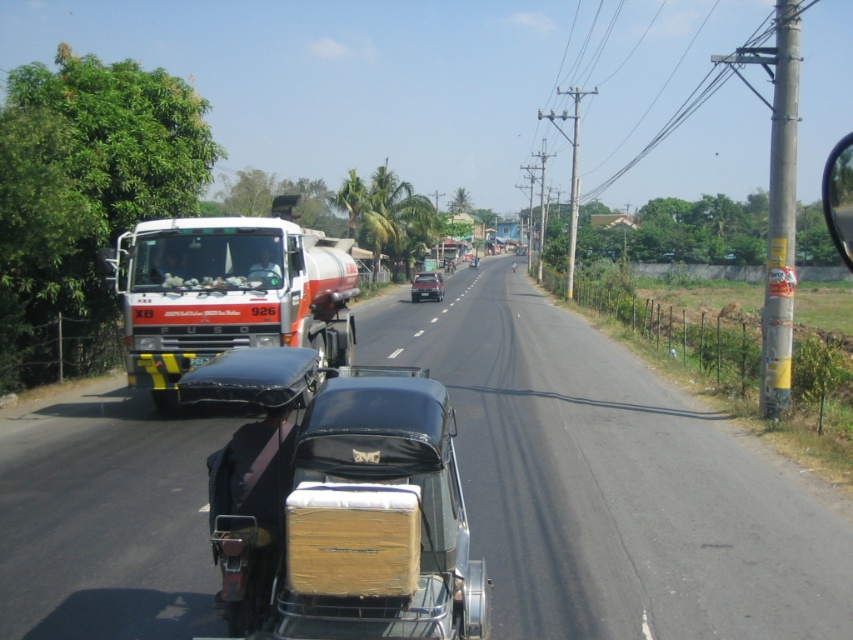
Does point (310, 556) come behind point (421, 291)?

No.

Who is shorter, matte black car at center or shiny silver sedan at center?

Standing shorter between the two is matte black car at center.

Is point (465, 540) in front of point (431, 280)?

Yes, point (465, 540) is in front of point (431, 280).

This screenshot has height=640, width=853. Find the location of `matte black car at center`. matte black car at center is located at coordinates (339, 502).

Can you confirm if matte black car at center is positioned to the right of white glossy fuel tanker at left?

Yes, matte black car at center is to the right of white glossy fuel tanker at left.

Identify the location of matte black car at center. (339, 502).

Measure the distance between shiny silver sedan at center and shiny black sedan at center.

shiny silver sedan at center and shiny black sedan at center are 228.53 feet apart from each other.

Which is in front, point (422, 292) or point (476, 260)?

Point (422, 292)

Identify the location of shiny silver sedan at center. The image size is (853, 640). (426, 285).